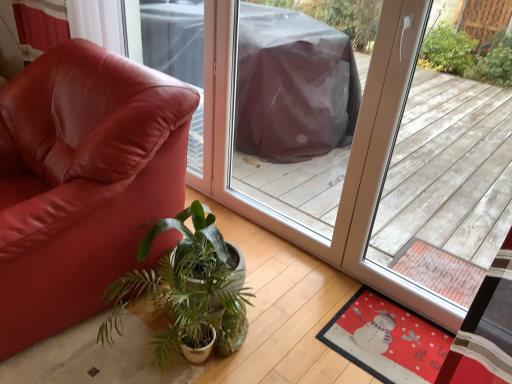
Question: Is matte leather chair at left located outside red felt mat at lower right?

Choices:
 (A) no
 (B) yes

Answer: (B)

Question: Can you see matte leather chair at left touching red felt mat at lower right?

Choices:
 (A) no
 (B) yes

Answer: (A)

Question: Does matte leather chair at left have a larger size compared to red felt mat at lower right?

Choices:
 (A) yes
 (B) no

Answer: (A)

Question: From a real-world perspective, is matte leather chair at left under red felt mat at lower right?

Choices:
 (A) yes
 (B) no

Answer: (B)

Question: Considering the relative sizes of matte leather chair at left and red felt mat at lower right in the image provided, is matte leather chair at left shorter than red felt mat at lower right?

Choices:
 (A) no
 (B) yes

Answer: (A)

Question: Considering their positions, is red felt mat at lower right located in front of or behind matte leather chair at left?

Choices:
 (A) front
 (B) behind

Answer: (B)

Question: In the image, is red felt mat at lower right on the left side or the right side of matte leather chair at left?

Choices:
 (A) left
 (B) right

Answer: (B)

Question: Looking at their shapes, would you say red felt mat at lower right is wider or thinner than matte leather chair at left?

Choices:
 (A) wide
 (B) thin

Answer: (B)

Question: From the image's perspective, is red felt mat at lower right positioned above or below matte leather chair at left?

Choices:
 (A) above
 (B) below

Answer: (B)

Question: Is point (349, 327) positioned closer to the camera than point (207, 254)?

Choices:
 (A) farther
 (B) closer

Answer: (A)

Question: Is red felt mat at lower right situated inside green leafy plant at center or outside?

Choices:
 (A) outside
 (B) inside

Answer: (A)

Question: In terms of width, does red felt mat at lower right look wider or thinner when compared to green leafy plant at center?

Choices:
 (A) thin
 (B) wide

Answer: (B)

Question: Considering the positions of red felt mat at lower right and green leafy plant at center in the image, is red felt mat at lower right bigger or smaller than green leafy plant at center?

Choices:
 (A) big
 (B) small

Answer: (B)

Question: Is green leafy plant at center to the left or to the right of red felt mat at lower right in the image?

Choices:
 (A) left
 (B) right

Answer: (A)

Question: From the image's perspective, is green leafy plant at center positioned above or below red felt mat at lower right?

Choices:
 (A) above
 (B) below

Answer: (A)